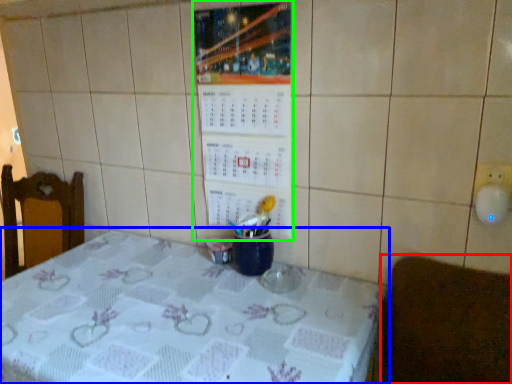
Question: Based on their relative distances, which object is farther from furniture (highlighted by a red box)? Choose from table (highlighted by a blue box) and bulletin board (highlighted by a green box).

Choices:
 (A) table
 (B) bulletin board

Answer: (B)